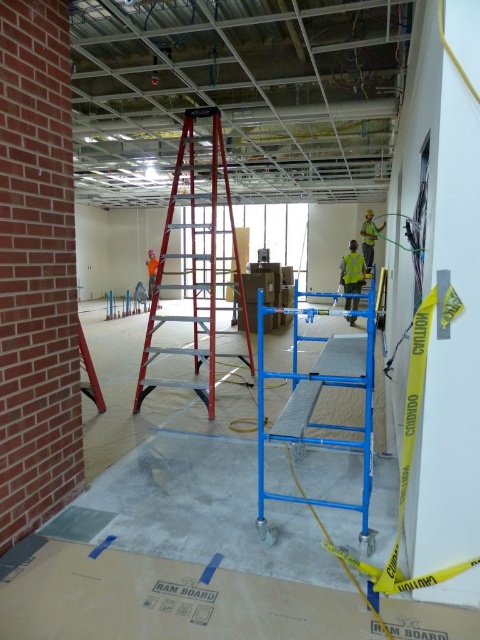
Between blue metallic scaffolding at center and reflective yellow safety vest at right, which one is positioned lower?

Positioned lower is blue metallic scaffolding at center.

Is blue metallic scaffolding at center behind reflective yellow safety vest at right?

No.

The width and height of the screenshot is (480, 640). I want to click on blue metallic scaffolding at center, so click(x=315, y=403).

Could you measure the distance between high visibility yellow safety vest at center and reflective yellow safety vest at right?

4.43 inches

Based on the photo, is high visibility yellow safety vest at center further to the viewer compared to reflective yellow safety vest at right?

No, high visibility yellow safety vest at center is in front of reflective yellow safety vest at right.

Image resolution: width=480 pixels, height=640 pixels. What do you see at coordinates (351, 269) in the screenshot?
I see `high visibility yellow safety vest at center` at bounding box center [351, 269].

Identify the location of high visibility yellow safety vest at center. The image size is (480, 640). (351, 269).

Is red aluminum ladder at center closer to camera compared to high visibility yellow safety vest at center?

That is True.

The width and height of the screenshot is (480, 640). I want to click on red aluminum ladder at center, so click(x=196, y=260).

Find the location of a particular element. red aluminum ladder at center is located at coordinates (196, 260).